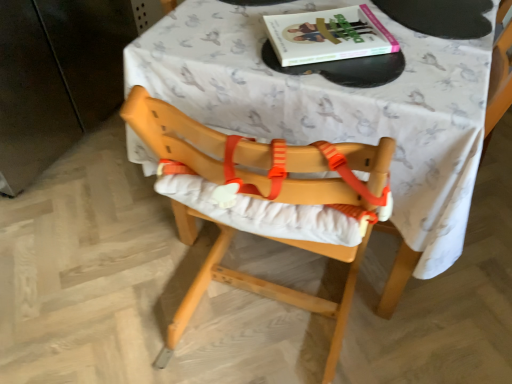
Question: From the image's perspective, is hardcover book at upper center beneath white fabric-covered table at center?

Choices:
 (A) no
 (B) yes

Answer: (A)

Question: Is hardcover book at upper center positioned with its back to white fabric-covered table at center?

Choices:
 (A) yes
 (B) no

Answer: (A)

Question: Does hardcover book at upper center have a larger size compared to white fabric-covered table at center?

Choices:
 (A) yes
 (B) no

Answer: (B)

Question: Is hardcover book at upper center further to the viewer compared to white fabric-covered table at center?

Choices:
 (A) no
 (B) yes

Answer: (B)

Question: Is hardcover book at upper center positioned beyond the bounds of white fabric-covered table at center?

Choices:
 (A) yes
 (B) no

Answer: (B)

Question: From a real-world perspective, is hardcover book at upper center positioned over white fabric-covered table at center based on gravity?

Choices:
 (A) no
 (B) yes

Answer: (B)

Question: Considering the relative positions of white fabric-covered table at center and natural wood highchair at center in the image provided, is white fabric-covered table at center to the right of natural wood highchair at center from the viewer's perspective?

Choices:
 (A) no
 (B) yes

Answer: (B)

Question: Is white fabric-covered table at center bigger than natural wood highchair at center?

Choices:
 (A) yes
 (B) no

Answer: (A)

Question: Can you confirm if white fabric-covered table at center is wider than natural wood highchair at center?

Choices:
 (A) yes
 (B) no

Answer: (A)

Question: Is white fabric-covered table at center further to camera compared to natural wood highchair at center?

Choices:
 (A) yes
 (B) no

Answer: (A)

Question: From a real-world perspective, is white fabric-covered table at center under natural wood highchair at center?

Choices:
 (A) yes
 (B) no

Answer: (A)

Question: Is there a large distance between white fabric-covered table at center and natural wood highchair at center?

Choices:
 (A) no
 (B) yes

Answer: (A)

Question: Is hardcover book at upper center aimed at natural wood highchair at center?

Choices:
 (A) no
 (B) yes

Answer: (B)